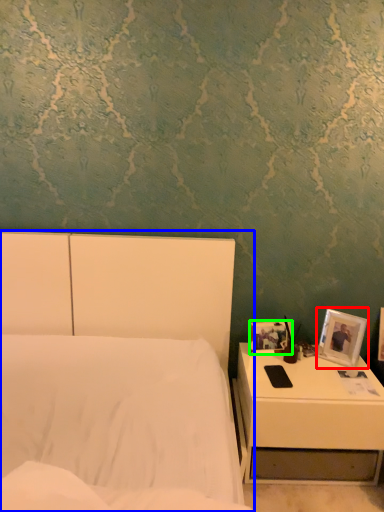
Question: Which is farther away from picture frame (highlighted by a red box)? bed (highlighted by a blue box) or picture frame (highlighted by a green box)?

Choices:
 (A) bed
 (B) picture frame

Answer: (A)